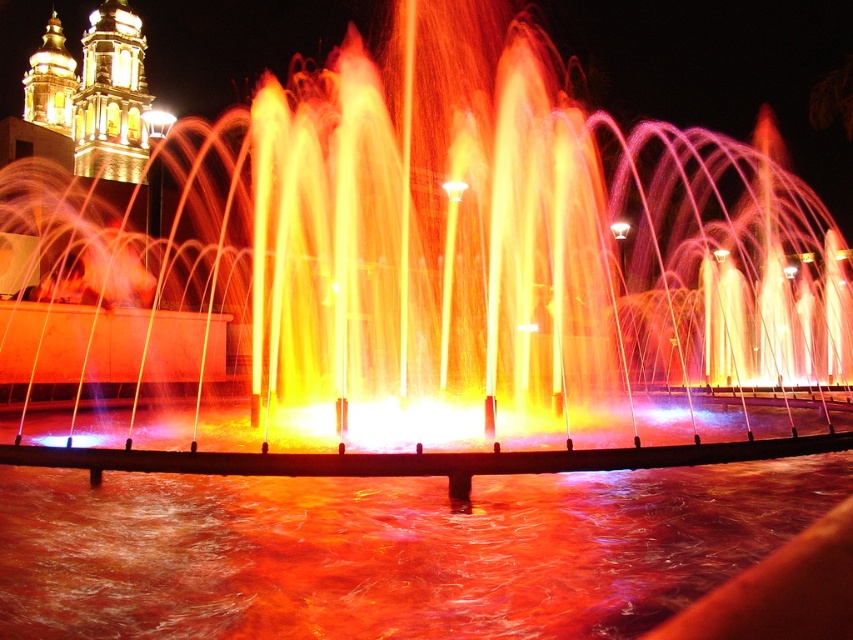
Is metallic water jets at center to the right of shiny orange water at center from the viewer's perspective?

No, metallic water jets at center is not to the right of shiny orange water at center.

Does metallic water jets at center appear under shiny orange water at center?

Incorrect, metallic water jets at center is not positioned below shiny orange water at center.

What do you see at coordinates (483, 257) in the screenshot? I see `metallic water jets at center` at bounding box center [483, 257].

I want to click on metallic water jets at center, so click(x=483, y=257).